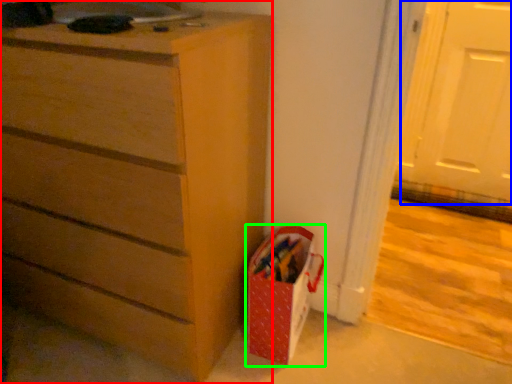
Question: Which object is positioned closest to chest of drawers (highlighted by a red box)? Select from screen door (highlighted by a blue box) and gift bag (highlighted by a green box).

Choices:
 (A) screen door
 (B) gift bag

Answer: (B)